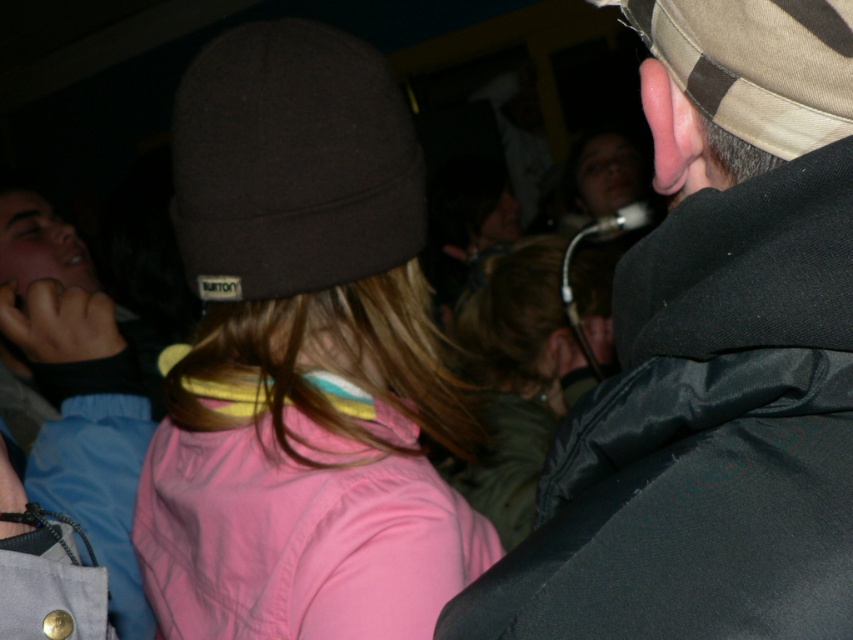
You are at a social event and need to find a place to hang your light blue denim jacket at left and khaki canvas cap at upper right. Which item should you choose to hang first if you want to use the shortest available hanger?

The khaki canvas cap at upper right should be hung first since it is shorter than the light blue denim jacket at left, allowing the shorter hanger to be used for it first.

You are organizing a hat display at a store and need to arrange the camouflage fabric cap at upper right and the khaki canvas cap at upper right on a shelf. Which cap should be placed first if you want to arrange them from largest to smallest?

The camouflage fabric cap at upper right should be placed first since it is bigger than the khaki canvas cap at upper right.

You are standing in the crowd and want to locate the camouflage fabric cap at upper right. According to the coordinates provided, where should you look relative to the center of the image?

The camouflage fabric cap at upper right is located at coordinates point (712, 358), which is to the right and slightly above the center of the image.